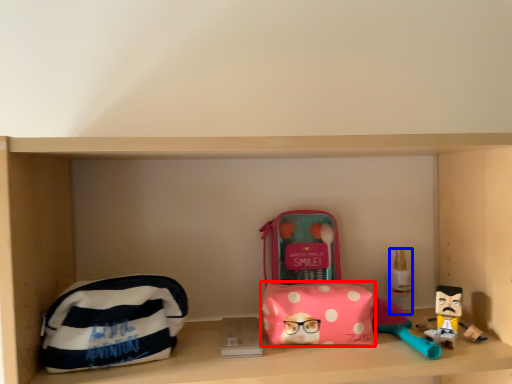
Question: Among these objects, which one is farthest to the camera, pouch (highlighted by a red box) or toiletry (highlighted by a blue box)?

Choices:
 (A) pouch
 (B) toiletry

Answer: (B)